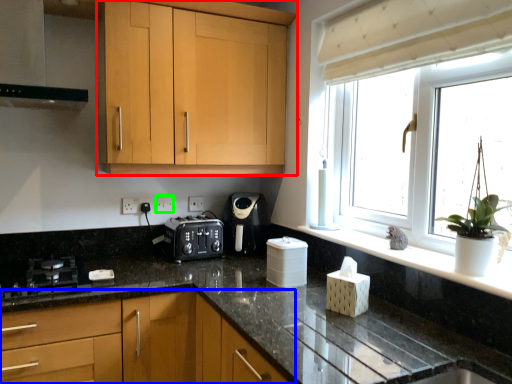
Question: Which is farther away from cabinetry (highlighted by a red box)? cabinetry (highlighted by a blue box) or electric outlet (highlighted by a green box)?

Choices:
 (A) cabinetry
 (B) electric outlet

Answer: (A)